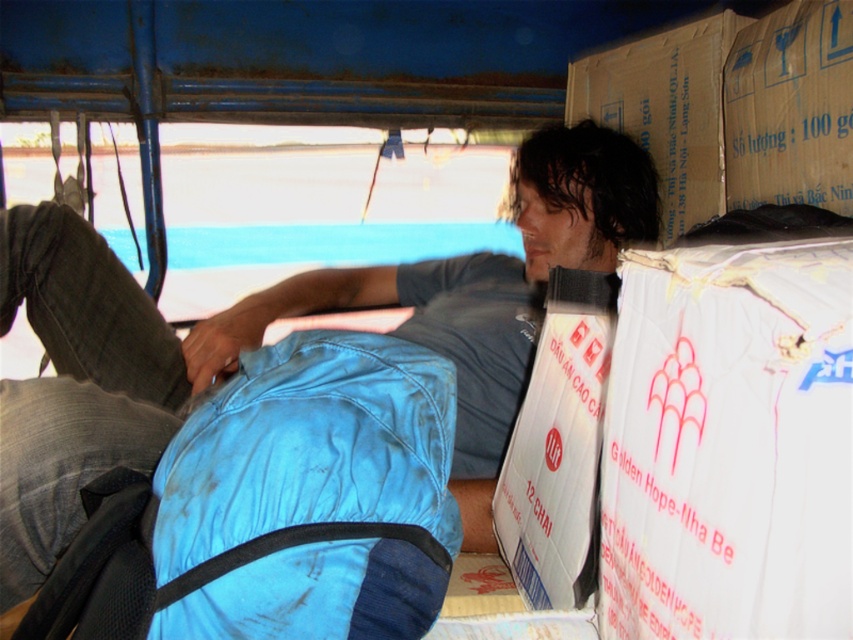
Question: Which of the following is the closest to the observer?

Choices:
 (A) brown cardboard box at upper right
 (B) blue fabric sleeping bag at lower center
 (C) blue fabric pants at center
 (D) white cardboard box at right

Answer: (D)

Question: Which point is farther to the camera?

Choices:
 (A) (653, 100)
 (B) (407, 348)

Answer: (A)

Question: Observing the image, what is the correct spatial positioning of blue fabric sleeping bag at lower center in reference to cardboard box at upper right?

Choices:
 (A) left
 (B) right

Answer: (A)

Question: Is cardboard box at upper right to the right of brown cardboard box at upper right from the viewer's perspective?

Choices:
 (A) no
 (B) yes

Answer: (B)

Question: Is white cardboard box at right wider than brown cardboard box at upper right?

Choices:
 (A) yes
 (B) no

Answer: (B)

Question: Based on their relative distances, which object is nearer to the white cardboard box at right?

Choices:
 (A) blue fabric pants at center
 (B) cardboard box at upper right
 (C) blue fabric sleeping bag at lower center

Answer: (C)